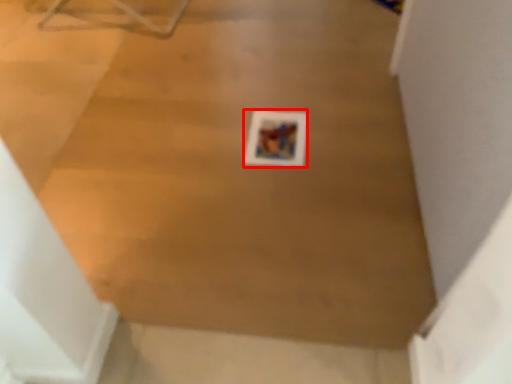
Question: From the image, what is the correct spatial relationship of print (annotated by the red box) in relation to plywood?

Choices:
 (A) right
 (B) left

Answer: (A)